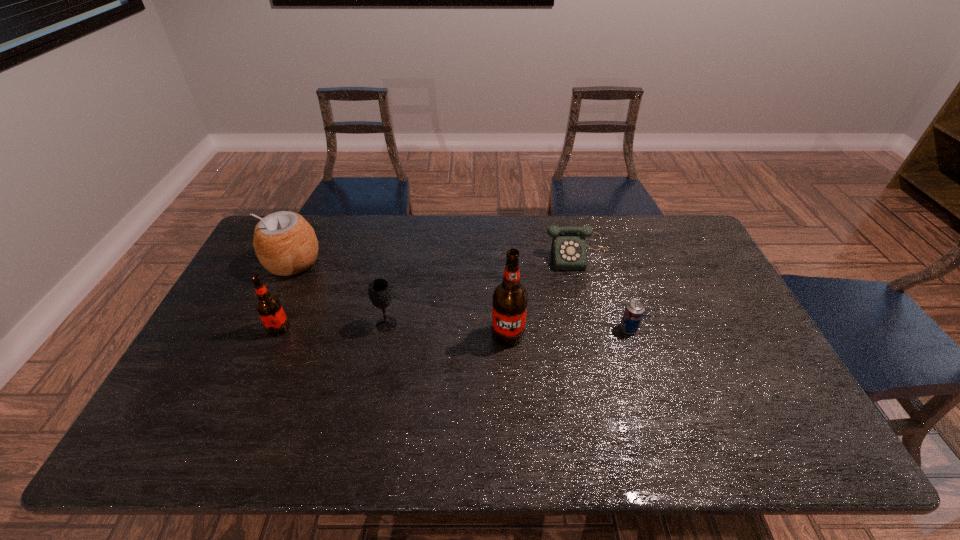
This screenshot has height=540, width=960. I want to click on the left root beer, so click(x=268, y=306).

Locate an element on the screen. the fourth object from left to right is located at coordinates (510, 299).

Image resolution: width=960 pixels, height=540 pixels. In order to click on the right root beer in this screenshot , I will do `click(510, 299)`.

Locate an element on the screen. telephone is located at coordinates (568, 250).

This screenshot has width=960, height=540. I want to click on wineglass, so click(x=379, y=291).

Identify the location of the fourth object from right to left. (379, 291).

Where is `coconut`? The image size is (960, 540). coconut is located at coordinates (285, 243).

Locate an element on the screen. The height and width of the screenshot is (540, 960). beer can is located at coordinates (634, 310).

Where is `vacant region located 0.170m on the right of the shorter root beer`? The width and height of the screenshot is (960, 540). vacant region located 0.170m on the right of the shorter root beer is located at coordinates (349, 328).

Where is `free spot located 0.390m on the back of the right root beer`? free spot located 0.390m on the back of the right root beer is located at coordinates (502, 239).